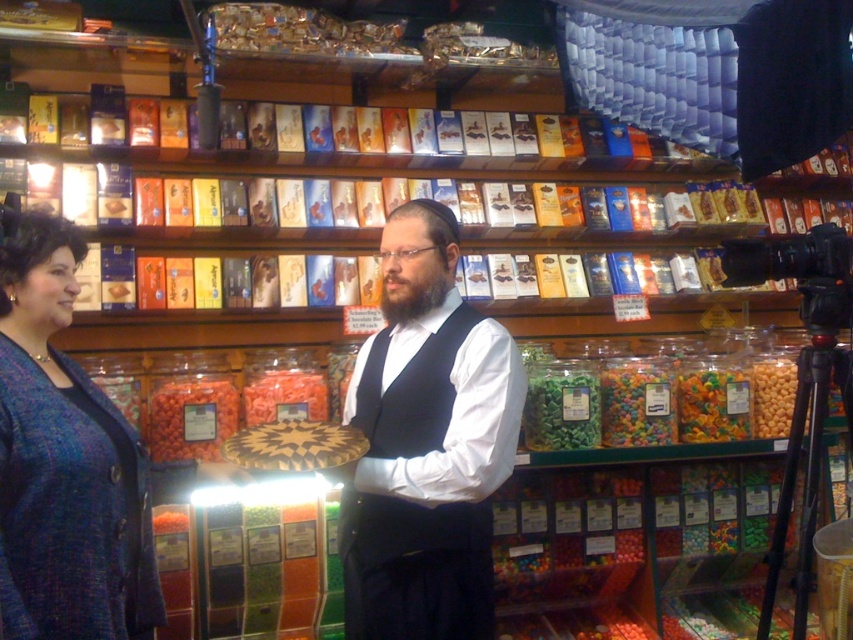
You are a store employee trying to arrange items on a shelf. You have a white matte vest at center and translucent rubber gummy bears at center. Which item should you place first if you want to prioritize fitting the wider item onto the shelf?

The white matte vest at center should be placed first because its width surpasses that of the translucent rubber gummy bears at center, ensuring the wider item is accommodated first.

You are a customer in the candy store and want to take a video of the display. You see the white matte vest at center and the black plastic video camera at upper right. Which object should you use to record the video?

You should use the black plastic video camera at upper right to record the video since it is a video camera, while the white matte vest at center is just clothing.